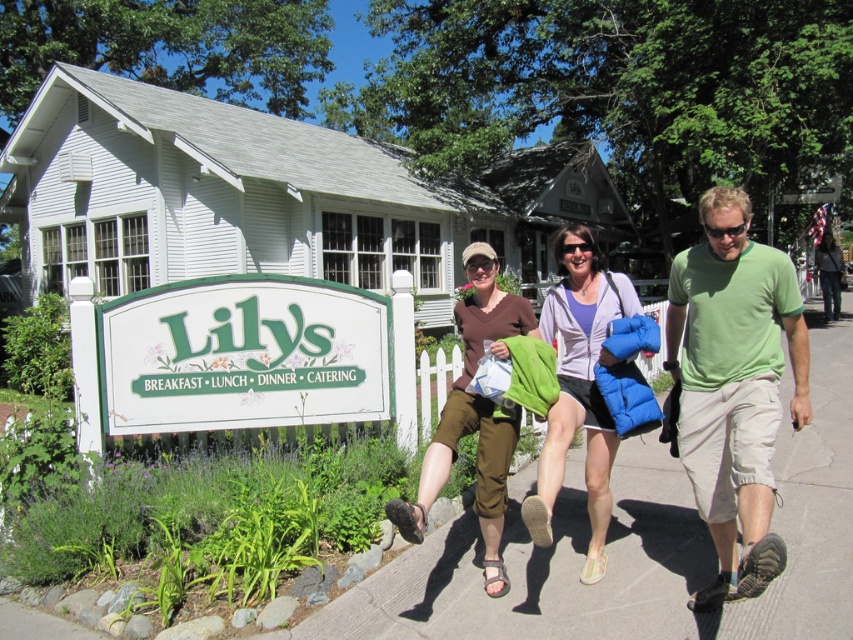
You are a photographer standing at the end of the path. You want to take a photo that includes both the brown cotton shirt at center and the denim jacket at center. Which object should you position closer to the left side of the frame to ensure both are visible?

The brown cotton shirt at center should be positioned closer to the left side of the frame since it is already to the left of the denim jacket at center in the scene.